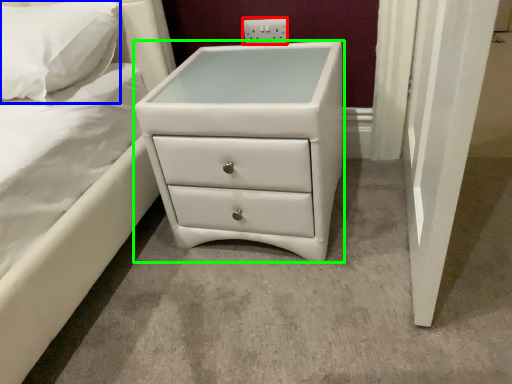
Question: Which object is the closest to the electric outlet (highlighted by a red box)? Choose among these: pillow (highlighted by a blue box) or chest of drawers (highlighted by a green box).

Choices:
 (A) pillow
 (B) chest of drawers

Answer: (B)